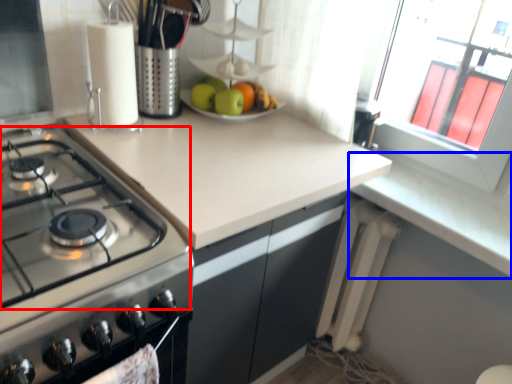
Question: Which object appears farthest to the camera in this image, gas stove (highlighted by a red box) or counter top (highlighted by a blue box)?

Choices:
 (A) gas stove
 (B) counter top

Answer: (B)